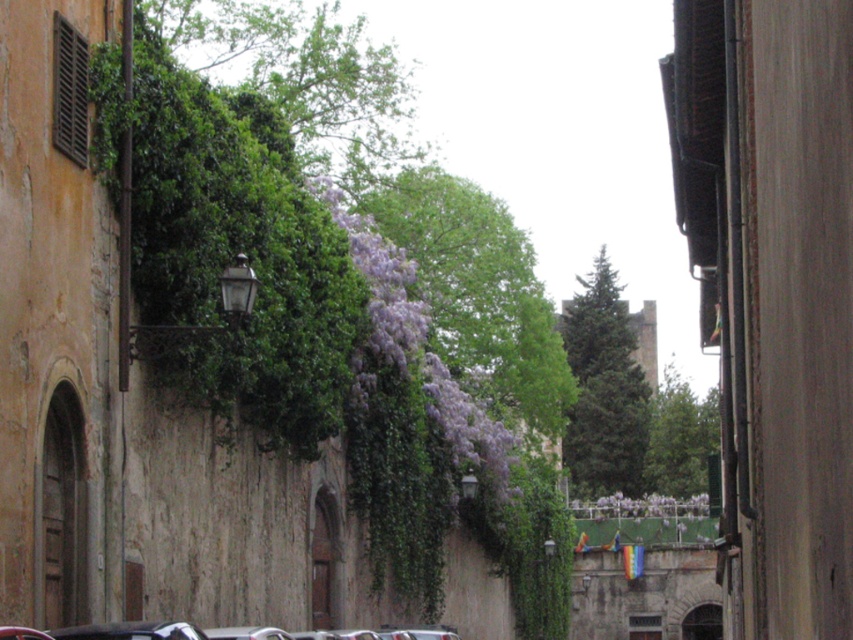
You are standing in the middle of the alleyway and want to take a photo of the purple leafy tree at center. To ensure the tree is centered in your photo, where should you position yourself relative to the tree?

Since the purple leafy tree at center is located at coordinates approximately 0.459 on the x and 0.562 on the y axis, positioning yourself directly in front of the tree along its central axis would ensure it is centered in the photo.

You are standing in the middle of the alleyway and see the point marked at coordinates (479,292). What does this point represent?

The point at (479,292) represents the purple leafy tree at center.

Consider the image. You are standing in an alleyway with a purple leafy tree at center. If you want to reach the tree quickly, should you walk forward or backward?

The purple leafy tree at center is 57.93 meters away from you, so you should walk forward to reach it quickly.